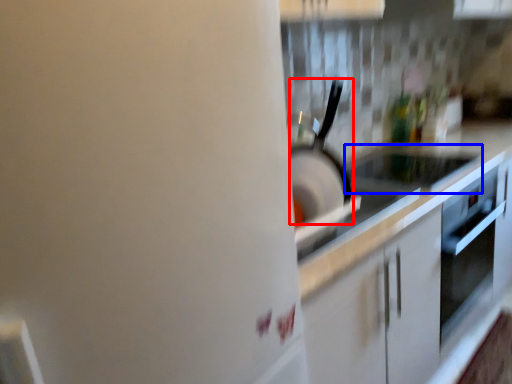
Question: Which object appears closest to the camera in this image, kitchen appliance (highlighted by a red box) or appliance (highlighted by a blue box)?

Choices:
 (A) kitchen appliance
 (B) appliance

Answer: (A)